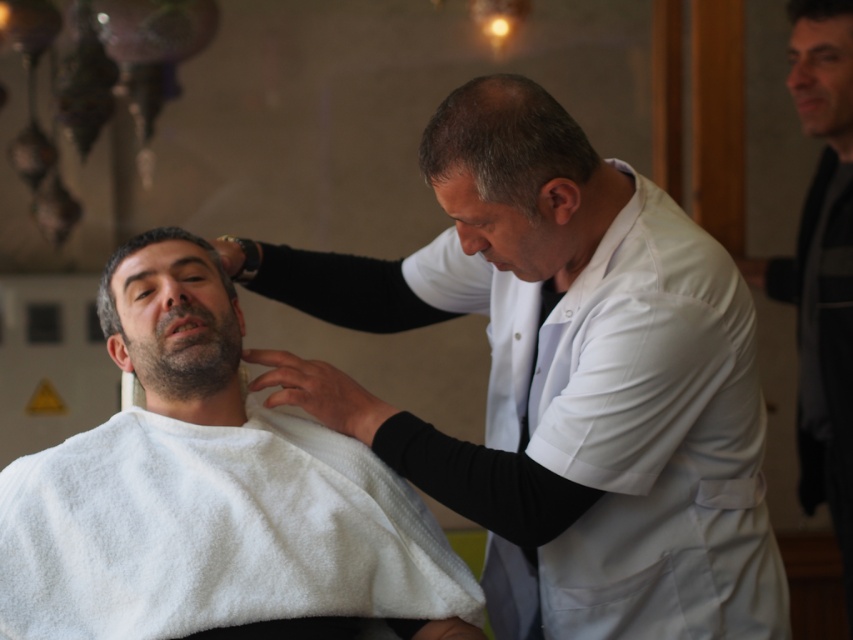
Question: Among these objects, which one is farthest from the camera?

Choices:
 (A) dark brown hair at center
 (B) black matte jacket at right
 (C) white matte coat at center
 (D) white cloth at center

Answer: (B)

Question: Which point is closer to the camera taking this photo?

Choices:
 (A) (114, 253)
 (B) (123, 550)
 (C) (614, 444)

Answer: (C)

Question: Is black matte jacket at right to the right of dark brown hair at center from the viewer's perspective?

Choices:
 (A) no
 (B) yes

Answer: (B)

Question: Can you confirm if white matte coat at center is thinner than black matte jacket at right?

Choices:
 (A) no
 (B) yes

Answer: (A)

Question: Which point is farther to the camera?

Choices:
 (A) (567, 440)
 (B) (817, 294)
 (C) (132, 243)
 (D) (22, 502)

Answer: (B)

Question: Observing the image, what is the correct spatial positioning of white matte coat at center in reference to dark brown hair at center?

Choices:
 (A) below
 (B) above

Answer: (A)